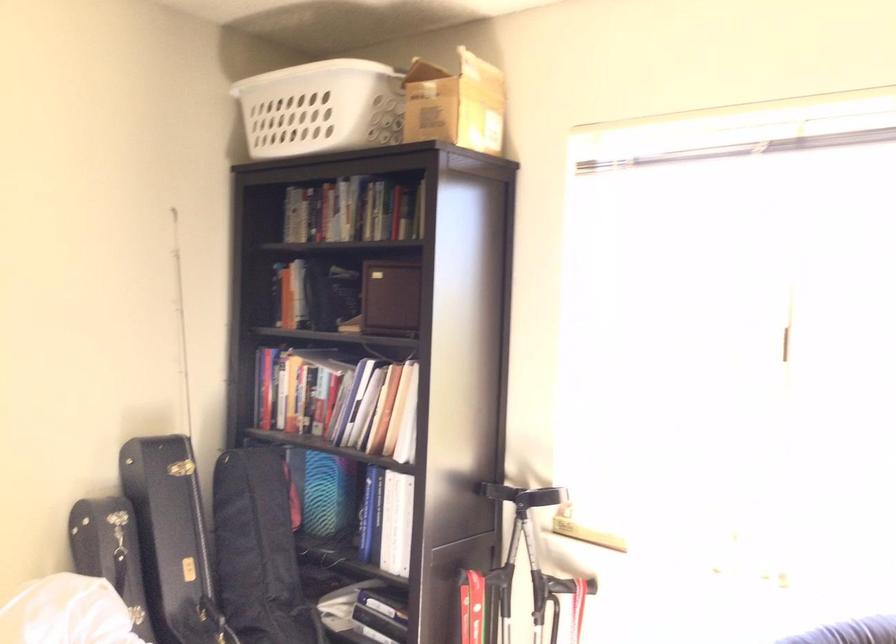
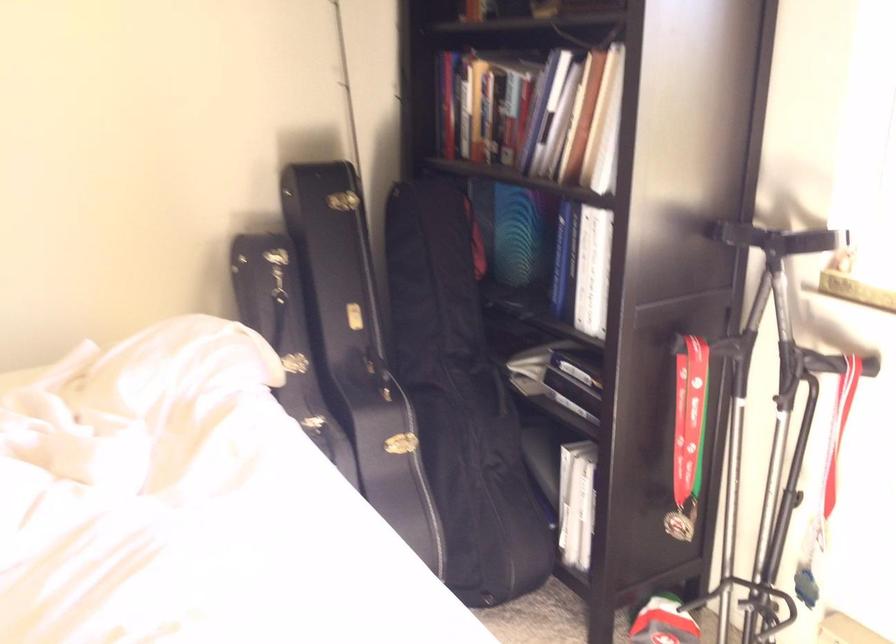
Find the pixel in the second image that matches pixel 323 495 in the first image.

(519, 236)